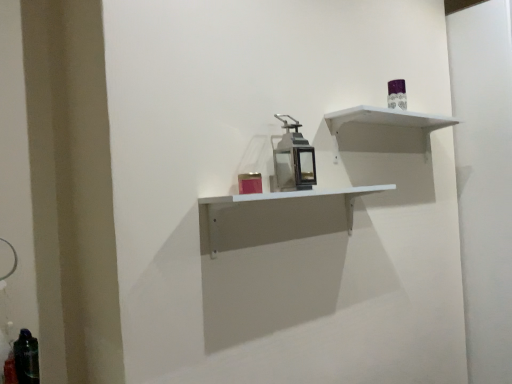
Question: Is white matte shelf at center, the 1th shelf from the bottom, further to camera compared to translucent dark green bottle at lower left?

Choices:
 (A) yes
 (B) no

Answer: (B)

Question: Does white matte shelf at center, the 1th shelf from the bottom, have a greater width compared to translucent dark green bottle at lower left?

Choices:
 (A) yes
 (B) no

Answer: (A)

Question: From the image's perspective, does white matte shelf at center, the second shelf viewed from the top, appear higher than translucent dark green bottle at lower left?

Choices:
 (A) no
 (B) yes

Answer: (B)

Question: Is white matte shelf at center, the second shelf viewed from the top, thinner than translucent dark green bottle at lower left?

Choices:
 (A) yes
 (B) no

Answer: (B)

Question: From a real-world perspective, is white matte shelf at center, the second shelf viewed from the top, positioned over translucent dark green bottle at lower left based on gravity?

Choices:
 (A) no
 (B) yes

Answer: (B)

Question: Can you confirm if white matte shelf at center, the 1th shelf from the bottom, is bigger than translucent dark green bottle at lower left?

Choices:
 (A) yes
 (B) no

Answer: (A)

Question: Can you confirm if metallic lantern at center is shorter than white matte shelf at center, the second shelf viewed from the top?

Choices:
 (A) no
 (B) yes

Answer: (A)

Question: From the image's perspective, is metallic lantern at center below white matte shelf at center, the 1th shelf from the bottom?

Choices:
 (A) yes
 (B) no

Answer: (B)

Question: Is metallic lantern at center not within white matte shelf at center, the second shelf viewed from the top?

Choices:
 (A) yes
 (B) no

Answer: (A)

Question: From a real-world perspective, is metallic lantern at center under white matte shelf at center, the second shelf viewed from the top?

Choices:
 (A) yes
 (B) no

Answer: (B)

Question: Is white matte shelf at center, the second shelf viewed from the top, completely or partially inside metallic lantern at center?

Choices:
 (A) no
 (B) yes

Answer: (A)

Question: Is metallic lantern at center wider than white matte shelf at center, the second shelf viewed from the top?

Choices:
 (A) yes
 (B) no

Answer: (B)

Question: Could you tell me if white matte shelf at center, the second shelf viewed from the top, is facing metallic lantern at center?

Choices:
 (A) yes
 (B) no

Answer: (B)